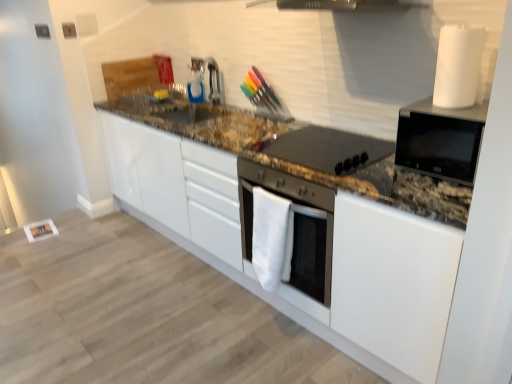
Question: Is white fabric oven at center, the first home appliance when ordered from left to right, at the back of black matte stovetop at center?

Choices:
 (A) yes
 (B) no

Answer: (B)

Question: From a real-world perspective, is black matte stovetop at center on white fabric oven at center, placed as the 1th home appliance when sorted from bottom to top?

Choices:
 (A) no
 (B) yes

Answer: (B)

Question: Is black matte stovetop at center at the right side of white fabric oven at center, the second home appliance positioned from the top?

Choices:
 (A) yes
 (B) no

Answer: (A)

Question: Is black matte stovetop at center in front of white fabric oven at center, the second home appliance positioned from the top?

Choices:
 (A) no
 (B) yes

Answer: (B)

Question: Is black matte stovetop at center taller than white fabric oven at center, the second home appliance positioned from the top?

Choices:
 (A) no
 (B) yes

Answer: (A)

Question: In the image, is black matte stovetop at center on the left side or the right side of satin nickel faucet at upper center?

Choices:
 (A) right
 (B) left

Answer: (A)

Question: Does point (329, 135) appear closer or farther from the camera than point (202, 79)?

Choices:
 (A) farther
 (B) closer

Answer: (B)

Question: From the image's perspective, is black matte stovetop at center positioned above or below satin nickel faucet at upper center?

Choices:
 (A) below
 (B) above

Answer: (A)

Question: From a real-world perspective, is black matte stovetop at center above or below satin nickel faucet at upper center?

Choices:
 (A) below
 (B) above

Answer: (A)

Question: Is black glossy microwave at upper right, the 1th home appliance in the top-to-bottom sequence, taller or shorter than black matte stovetop at center?

Choices:
 (A) tall
 (B) short

Answer: (A)

Question: Is black glossy microwave at upper right, the 1th home appliance in the top-to-bottom sequence, to the left or to the right of black matte stovetop at center in the image?

Choices:
 (A) left
 (B) right

Answer: (B)

Question: In terms of width, does black glossy microwave at upper right, acting as the second home appliance starting from the left, look wider or thinner when compared to black matte stovetop at center?

Choices:
 (A) wide
 (B) thin

Answer: (B)

Question: Is black glossy microwave at upper right, which appears as the 2th home appliance when ordered from the bottom, in front of or behind black matte stovetop at center in the image?

Choices:
 (A) front
 (B) behind

Answer: (A)

Question: From the image's perspective, is white fabric oven at center, the second home appliance positioned from the top, above or below satin nickel faucet at upper center?

Choices:
 (A) above
 (B) below

Answer: (B)

Question: Relative to satin nickel faucet at upper center, is white fabric oven at center, the second home appliance positioned from the top, in front or behind?

Choices:
 (A) front
 (B) behind

Answer: (A)